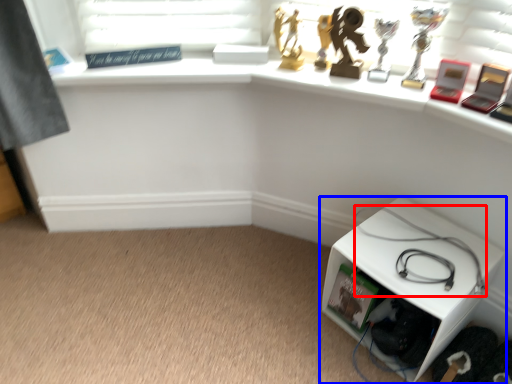
Question: Which point is further to the camera, cable (highlighted by a red box) or furniture (highlighted by a blue box)?

Choices:
 (A) cable
 (B) furniture

Answer: (A)